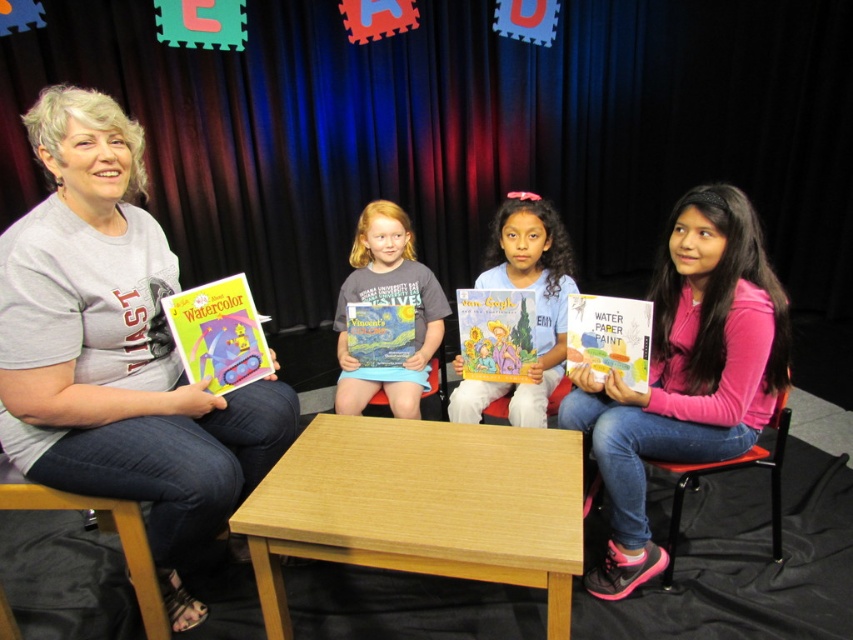
The width and height of the screenshot is (853, 640). Find the location of `matte blue book at center`. matte blue book at center is located at coordinates (535, 304).

Does gray cotton shirt at center lie in front of matte paper book at center?

That is False.

Can you confirm if gray cotton shirt at center is positioned below matte paper book at center?

No, gray cotton shirt at center is not below matte paper book at center.

Identify the location of gray cotton shirt at center. The height and width of the screenshot is (640, 853). (387, 301).

Is pink zip-up jacket at right taller than matte blue book at center?

Correct, pink zip-up jacket at right is much taller as matte blue book at center.

The image size is (853, 640). What are the coordinates of `pink zip-up jacket at right` in the screenshot? It's located at (686, 372).

Where is `pink zip-up jacket at right`? pink zip-up jacket at right is located at coordinates (686, 372).